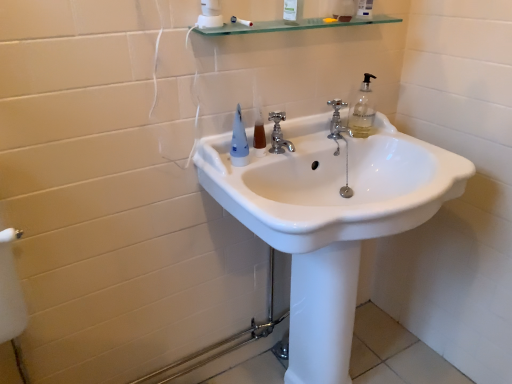
Question: Which is correct: transparent glass shelf at upper center is inside polished chrome faucet at center, the 1th tap positioned from the right, or outside of it?

Choices:
 (A) inside
 (B) outside

Answer: (B)

Question: Relative to polished chrome faucet at center, arranged as the first tap when viewed from the back, is transparent glass shelf at upper center in front or behind?

Choices:
 (A) front
 (B) behind

Answer: (A)

Question: Considering the real-world distances, which object is farthest from the polished chrome faucet at center, the 1th tap from the left?

Choices:
 (A) translucent plastic mouthwash at center
 (B) transparent glass shelf at upper center
 (C) white glossy sink at center
 (D) matte blue plastic toothbrush at upper center
 (E) polished chrome faucet at center, arranged as the first tap when viewed from the back

Answer: (C)

Question: Which object is the farthest from the transparent glass shelf at upper center?

Choices:
 (A) white glossy sink at center
 (B) polished chrome faucet at center, which ranks as the 1th tap in front-to-back order
 (C) matte blue plastic toothbrush at upper center
 (D) translucent plastic mouthwash at center
 (E) polished chrome faucet at center, the 1th tap positioned from the right

Answer: (A)